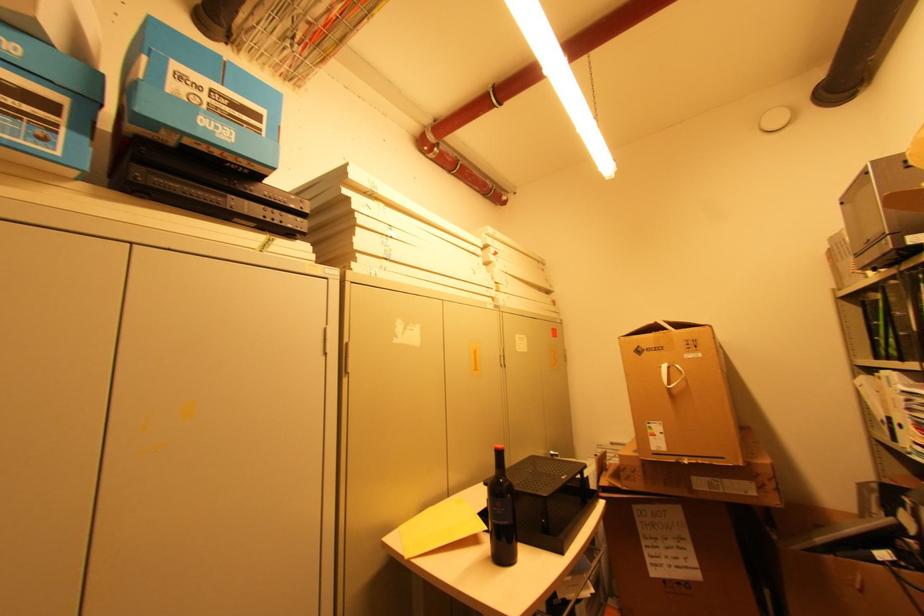
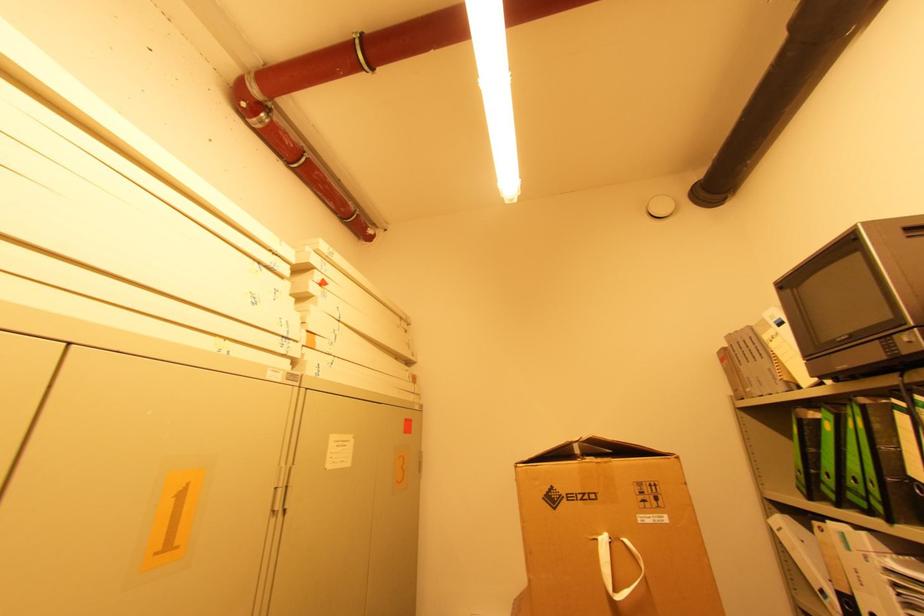
Find the pixel in the second image that matches point (881, 341) in the first image.

(822, 476)